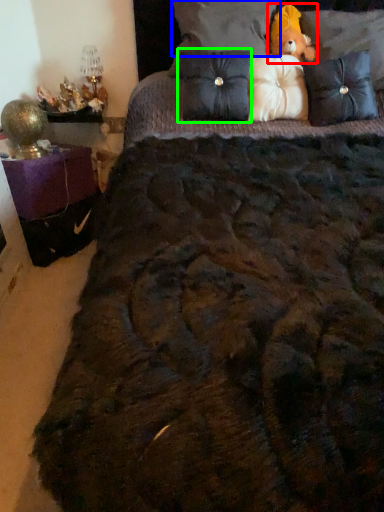
Question: Which object is positioned farthest from figurine (highlighted by a red box)? Select from pillow (highlighted by a blue box) and pillow (highlighted by a green box).

Choices:
 (A) pillow
 (B) pillow

Answer: (B)